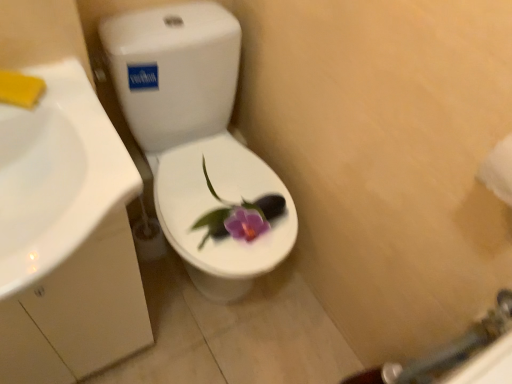
Find the location of a particular element. white paper towel at right is located at coordinates (498, 170).

In the image, is white paper towel at right on the left side or the right side of white glossy sink at left?

Clearly, white paper towel at right is on the right of white glossy sink at left in the image.

Does white paper towel at right have a larger size compared to white glossy sink at left?

No, white paper towel at right is not bigger than white glossy sink at left.

The image size is (512, 384). What are the coordinates of `sink on the left of white paper towel at right` in the screenshot? It's located at (57, 175).

From a real-world perspective, is white paper towel at right over white glossy sink at left?

Yes, from a real-world perspective, white paper towel at right is on top of white glossy sink at left.

Which object is closer to the camera taking this photo, white glossy sink at left or white glossy toilet at center?

white glossy sink at left.

Considering the relative sizes of white glossy sink at left and white glossy toilet at center in the image provided, is white glossy sink at left smaller than white glossy toilet at center?

Yes.

From a real-world perspective, which object stands above the other?

In real-world perspective, white glossy sink at left is above.

From the image's perspective, is white glossy sink at left located beneath white glossy toilet at center?

Indeed, from the image's perspective, white glossy sink at left is shown beneath white glossy toilet at center.

Considering the positions of objects white glossy toilet at center and white glossy sink at left in the image provided, who is more to the left, white glossy toilet at center or white glossy sink at left?

Positioned to the left is white glossy sink at left.

Which of these two, white glossy toilet at center or white glossy sink at left, stands taller?

With more height is white glossy toilet at center.

Is white glossy toilet at center facing away from white glossy sink at left?

No, white glossy toilet at center is not facing the opposite direction of white glossy sink at left.

Does point (160, 34) come behind point (29, 237)?

Yes, point (160, 34) is farther from viewer.

You are a GUI agent. You are given a task and a screenshot of the screen. Output one action in this format:
    pyautogui.click(x=<x>, y=<y>)
    Task: Click on the toilet behind the white paper towel at right
    
    Given the screenshot: What is the action you would take?
    pyautogui.click(x=197, y=141)

From the picture: Between white paper towel at right and white glossy toilet at center, which one is positioned behind?

white glossy toilet at center.

From the image's perspective, which one is positioned higher, white paper towel at right or white glossy toilet at center?

white glossy toilet at center appears higher in the image.

Who is more distant, white glossy sink at left or white paper towel at right?

white paper towel at right.

From the image's perspective, which one is positioned higher, white glossy sink at left or white paper towel at right?

white paper towel at right.

Which of these two, white glossy sink at left or white paper towel at right, stands taller?

white glossy sink at left.

Which object is thinner, white glossy sink at left or white paper towel at right?

With smaller width is white paper towel at right.

In the image, is white glossy toilet at center positioned in front of or behind white paper towel at right?

Clearly, white glossy toilet at center is behind white paper towel at right.

From a real-world perspective, is white glossy toilet at center located higher than white paper towel at right?

No.

Considering the relative positions of white glossy toilet at center and white paper towel at right in the image provided, is white glossy toilet at center to the right of white paper towel at right from the viewer's perspective?

No.

How distant is white glossy toilet at center from white paper towel at right?

A distance of 27.99 inches exists between white glossy toilet at center and white paper towel at right.

This screenshot has height=384, width=512. What are the coordinates of `toilet paper above the white glossy sink at left (from the image's perspective)` in the screenshot? It's located at (498, 170).

The width and height of the screenshot is (512, 384). In order to click on sink lying on the left of white glossy toilet at center in this screenshot , I will do `click(57, 175)`.

Which object lies further to the anchor point white paper towel at right, white glossy toilet at center or white glossy sink at left?

Based on the image, white glossy toilet at center appears to be further to white paper towel at right.

From the image, which object appears to be farther from white glossy sink at left, white glossy toilet at center or white paper towel at right?

white paper towel at right is further to white glossy sink at left.

Looking at the image, which one is located closer to white glossy sink at left, white paper towel at right or white glossy toilet at center?

white glossy toilet at center.

When comparing their distances from white paper towel at right, does white glossy sink at left or white glossy toilet at center seem further?

Based on the image, white glossy toilet at center appears to be further to white paper towel at right.

Considering their positions, is white glossy sink at left positioned further to white glossy toilet at center than white paper towel at right?

white paper towel at right is further to white glossy toilet at center.

Looking at the image, which one is located further to white glossy toilet at center, white paper towel at right or white glossy sink at left?

white paper towel at right is positioned further to the anchor white glossy toilet at center.

The width and height of the screenshot is (512, 384). Find the location of `toilet located between white glossy sink at left and white paper towel at right in the left-right direction`. toilet located between white glossy sink at left and white paper towel at right in the left-right direction is located at coordinates (197, 141).